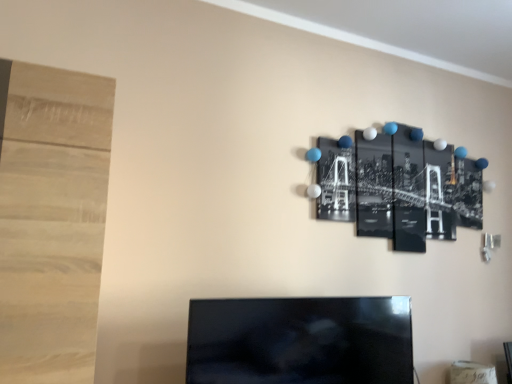
Question: From a real-world perspective, is black glossy tv at center physically below black glossy photo at upper right?

Choices:
 (A) no
 (B) yes

Answer: (B)

Question: Is black glossy tv at center outside of black glossy photo at upper right?

Choices:
 (A) yes
 (B) no

Answer: (A)

Question: Could you tell me if black glossy tv at center is turned towards black glossy photo at upper right?

Choices:
 (A) yes
 (B) no

Answer: (B)

Question: Is black glossy tv at center not close to black glossy photo at upper right?

Choices:
 (A) yes
 (B) no

Answer: (B)

Question: Is black glossy tv at center positioned behind black glossy photo at upper right?

Choices:
 (A) no
 (B) yes

Answer: (A)

Question: Is black glossy tv at center shorter than black glossy photo at upper right?

Choices:
 (A) yes
 (B) no

Answer: (A)

Question: Is black glossy photo at upper right surrounding black glossy tv at center?

Choices:
 (A) no
 (B) yes

Answer: (A)

Question: From a real-world perspective, is black glossy photo at upper right on top of black glossy tv at center?

Choices:
 (A) no
 (B) yes

Answer: (B)

Question: Can you confirm if black glossy photo at upper right is shorter than black glossy tv at center?

Choices:
 (A) yes
 (B) no

Answer: (B)

Question: Is black glossy photo at upper right further to the viewer compared to black glossy tv at center?

Choices:
 (A) no
 (B) yes

Answer: (B)

Question: Is black glossy photo at upper right thinner than black glossy tv at center?

Choices:
 (A) yes
 (B) no

Answer: (A)

Question: Is black glossy photo at upper right looking in the opposite direction of black glossy tv at center?

Choices:
 (A) yes
 (B) no

Answer: (B)

Question: Choose the correct answer: Is black glossy photo at upper right inside black glossy tv at center or outside it?

Choices:
 (A) outside
 (B) inside

Answer: (A)